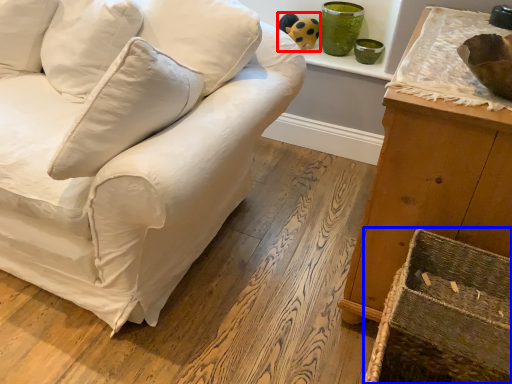
Question: Which point is further to the camera, toy (highlighted by a red box) or crate (highlighted by a blue box)?

Choices:
 (A) toy
 (B) crate

Answer: (A)